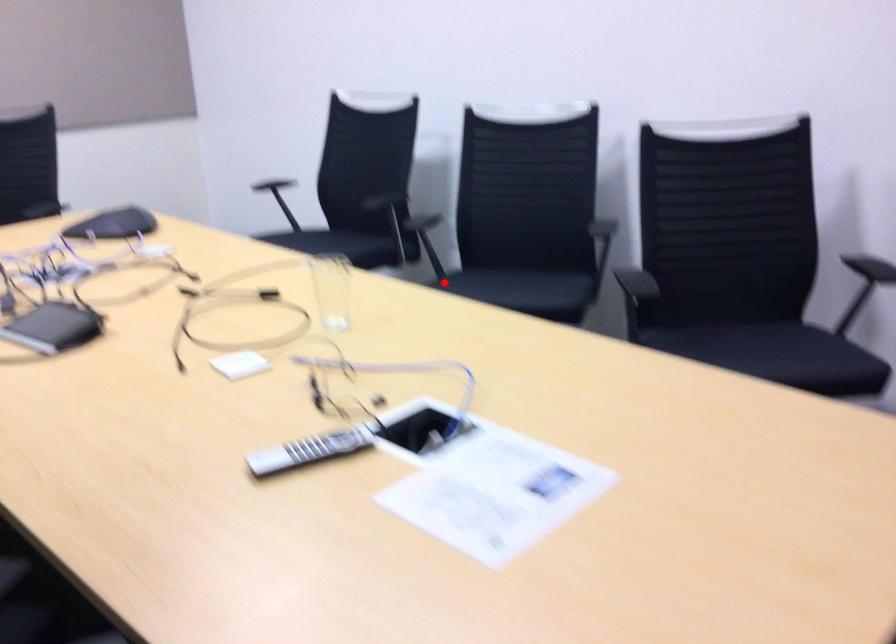
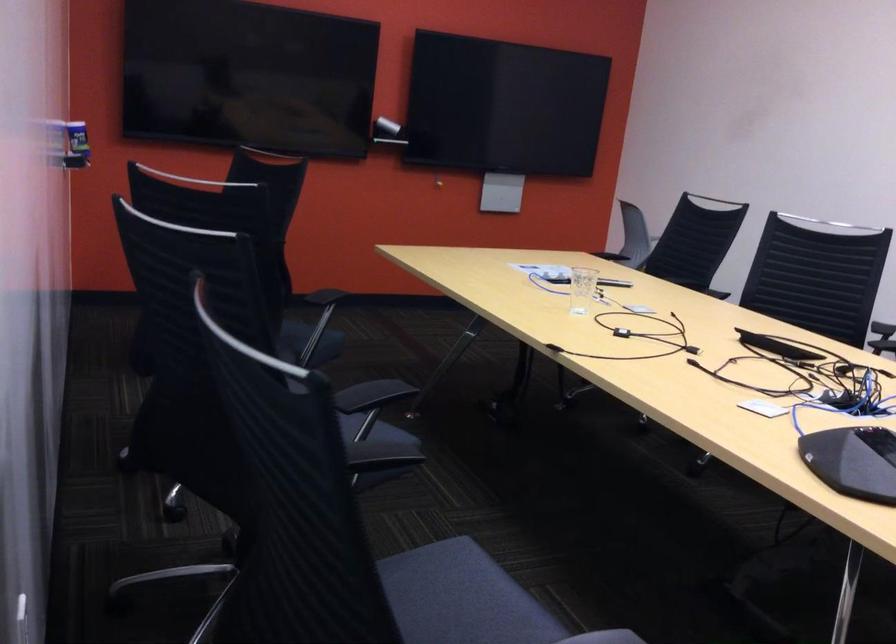
The point at the highlighted location is marked in the first image. Where is the corresponding point in the second image?

(374, 430)